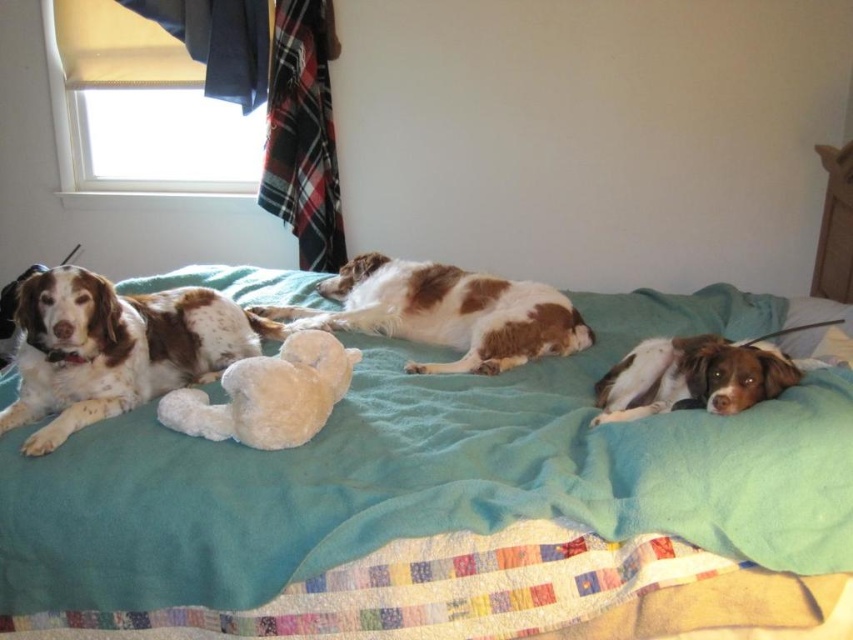
You are a small toy mouse that is 3 inches long. You want to move from the teal soft blanket at center to the white fluffy teddy bear at center. Is there enough space for you to move freely between them?

The distance between the teal soft blanket at center and the white fluffy teddy bear at center is 8.68 inches, so yes, the toy mouse can move freely between them since the distance is more than double its length.

You are trying to place a new toy between the speckled white fur dog at left and the white fluffy teddy bear at center on the bed. Based on their sizes, will there be enough space between them to fit a small 10cm toy?

The speckled white fur dog at left might be wider than the white fluffy teddy bear at center, so there may not be enough space between them to fit a small 10cm toy.